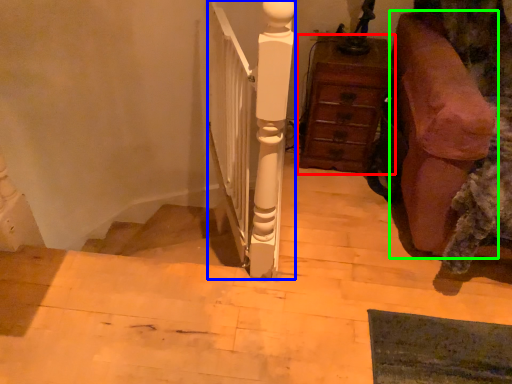
Question: Considering the real-world distances, which object is farthest from chest of drawers (highlighted by a red box)? rail (highlighted by a blue box) or furniture (highlighted by a green box)?

Choices:
 (A) rail
 (B) furniture

Answer: (A)